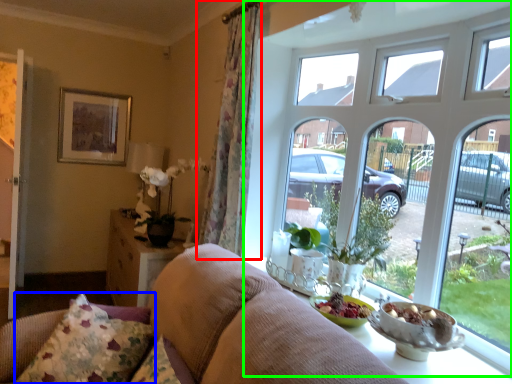
Question: Considering the real-world distances, which object is closest to curtain (highlighted by a red box)? pillow (highlighted by a blue box) or window (highlighted by a green box).

Choices:
 (A) pillow
 (B) window

Answer: (B)